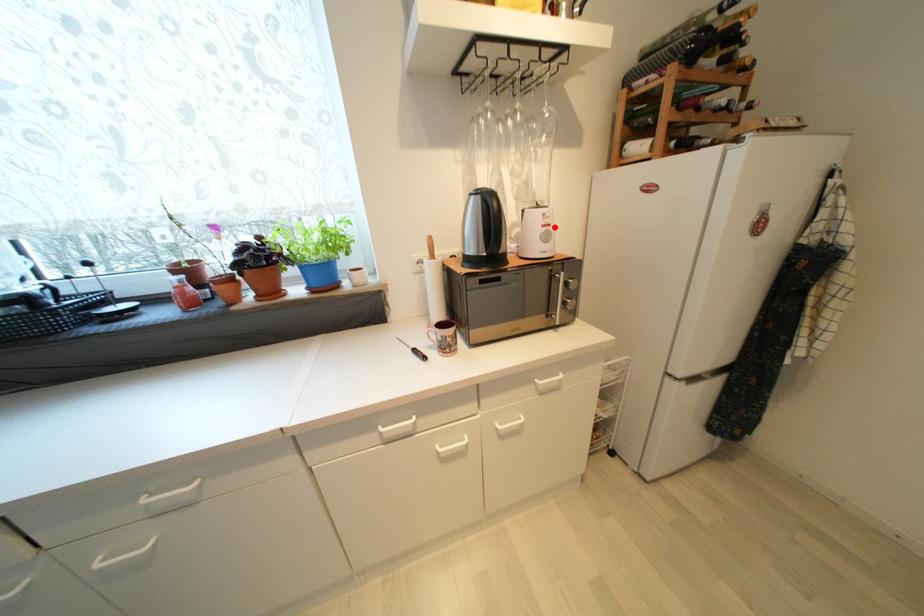
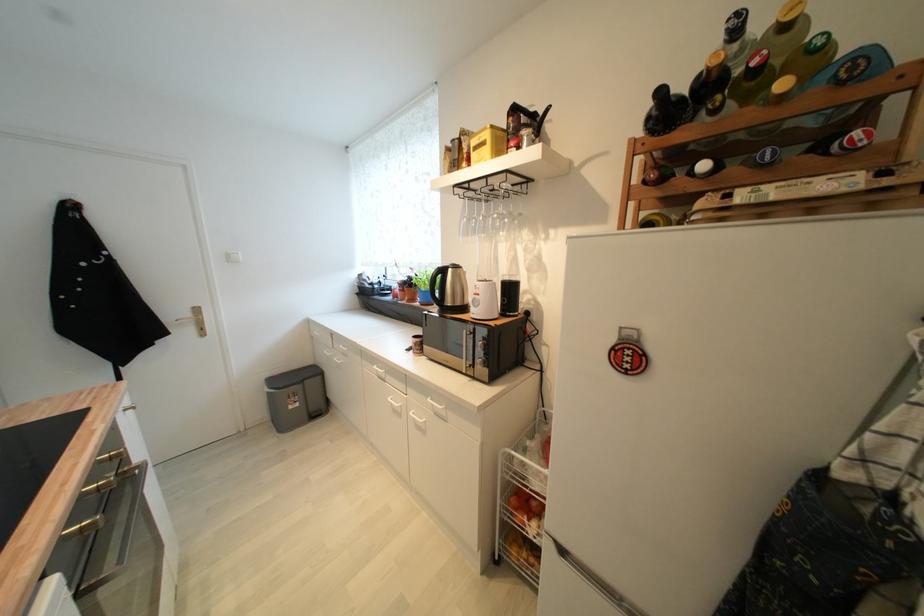
Where in the second image is the point corresponding to the highlighted location from the first image?

(483, 296)